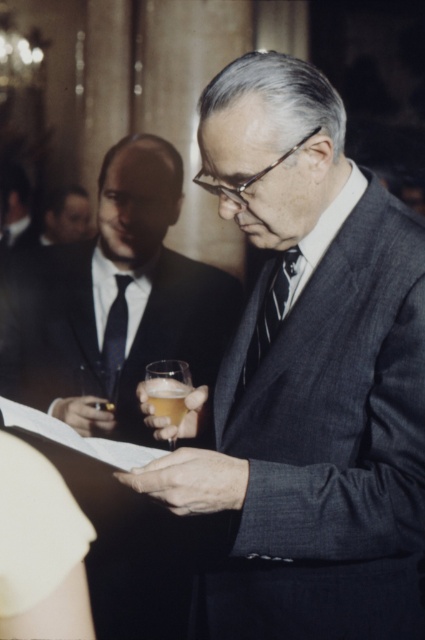
Does dark suit at center have a larger size compared to translucent glass at center?

Yes, dark suit at center is bigger than translucent glass at center.

Between dark suit at center and translucent glass at center, which one is positioned lower?

translucent glass at center

Between point (14, 218) and point (163, 381), which one is positioned in front?

Point (163, 381) is more forward.

Identify the location of dark suit at center. (16, 205).

Which is above, dark suit at center or black silk tie at left?

dark suit at center

Is point (19, 198) farther from camera compared to point (115, 342)?

Yes, it is.

This screenshot has width=425, height=640. What are the coordinates of `dark suit at center` in the screenshot? It's located at (16, 205).

Between point (104, 260) and point (181, 419), which one is positioned behind?

The point (104, 260) is behind.

Which is in front, point (159, 273) or point (183, 397)?

Point (183, 397) is in front.

This screenshot has height=640, width=425. What do you see at coordinates (115, 301) in the screenshot?
I see `matte glass beer at center` at bounding box center [115, 301].

Locate an element on the screen. The height and width of the screenshot is (640, 425). matte glass beer at center is located at coordinates (115, 301).